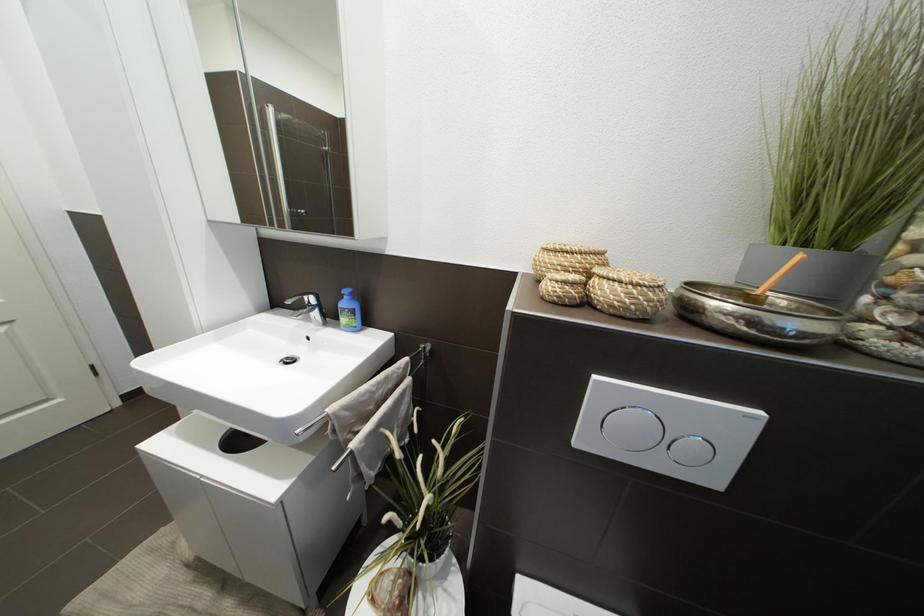
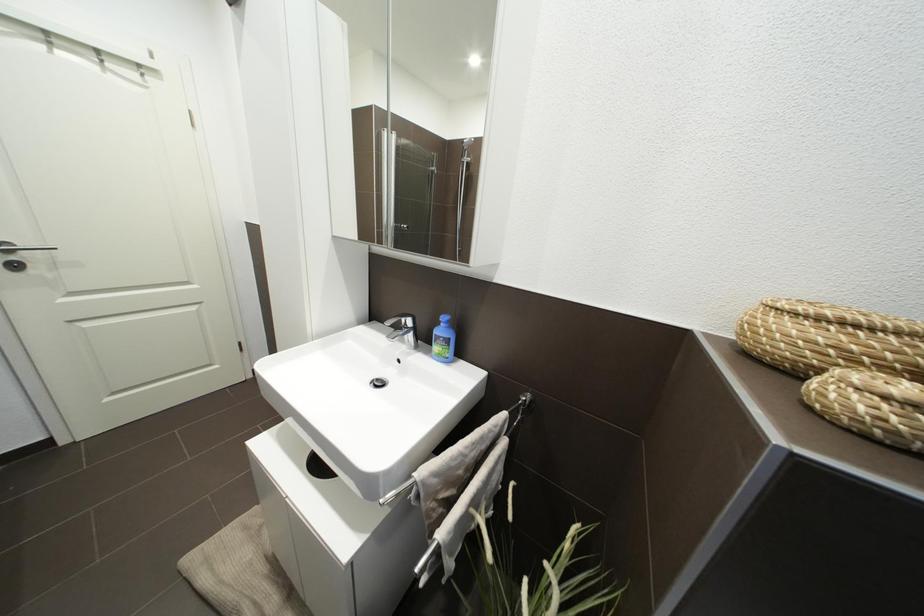
What movement of the cameraman would produce the second image?

The movement direction of the cameraman is left, forward.